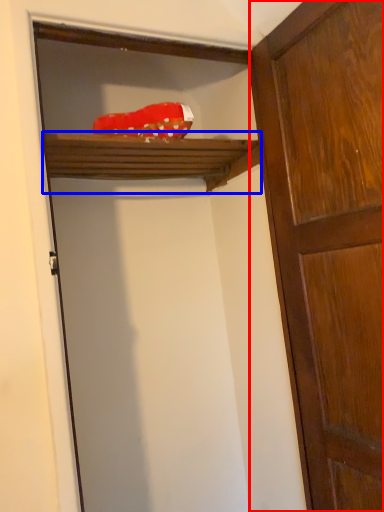
Question: Which of the following is the closest to the observer, door (highlighted by a red box) or shelf (highlighted by a blue box)?

Choices:
 (A) door
 (B) shelf

Answer: (A)